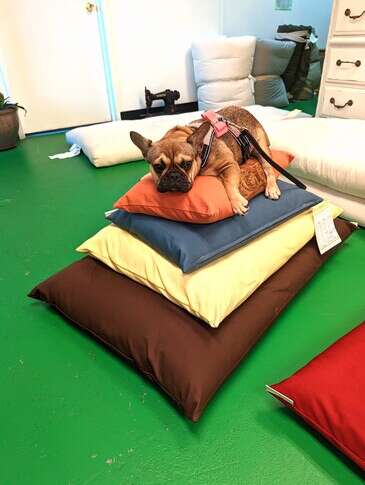
The height and width of the screenshot is (485, 365). Identify the location of rolled bed. (270, 57), (221, 70), (300, 61).